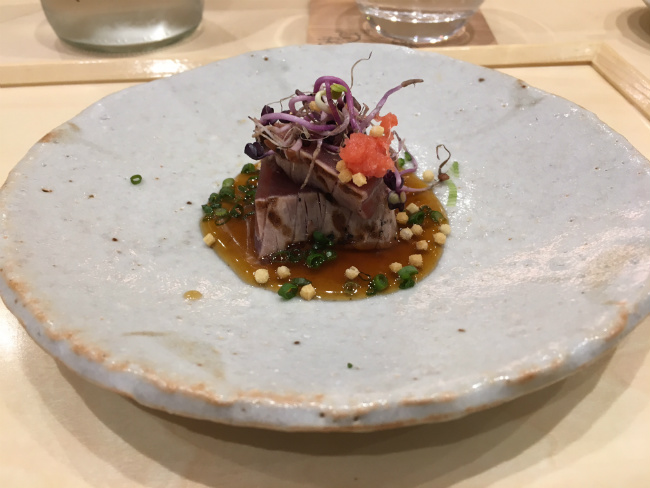
Find the location of `wooden surface`. wooden surface is located at coordinates (12, 133).